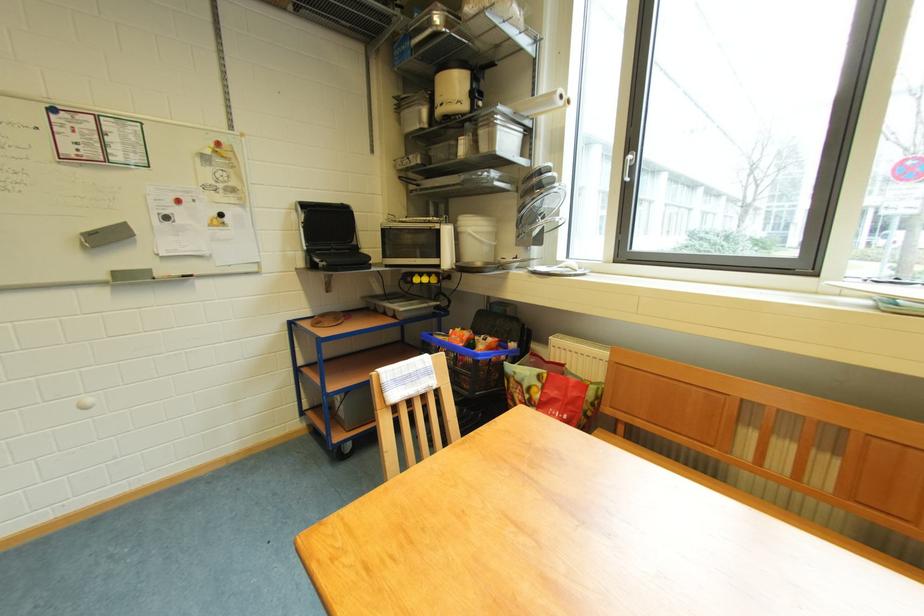
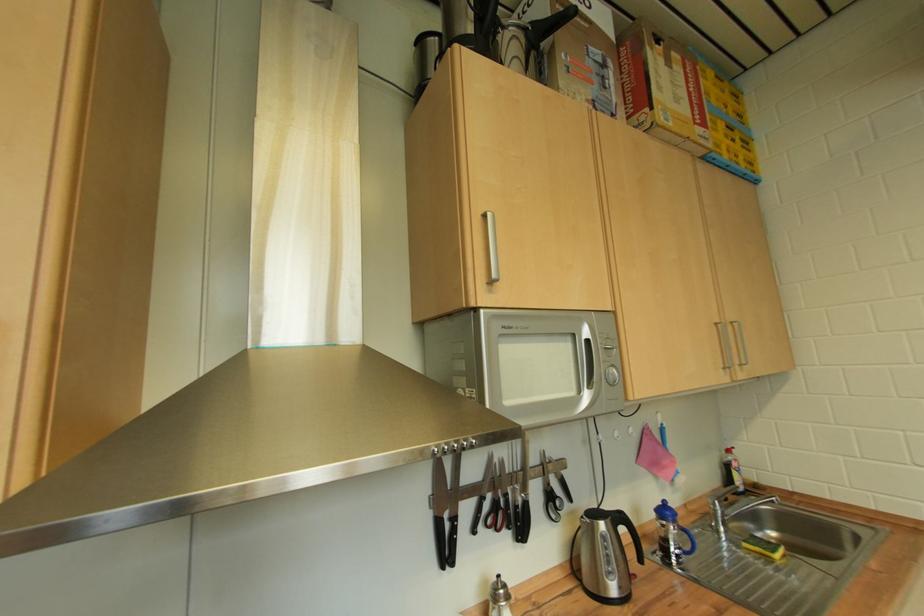
Question: The first image is from the beginning of the video and the second image is from the end. How did the camera likely rotate when shooting the video?

Choices:
 (A) Left
 (B) Right
 (C) Up
 (D) Down

Answer: (A)